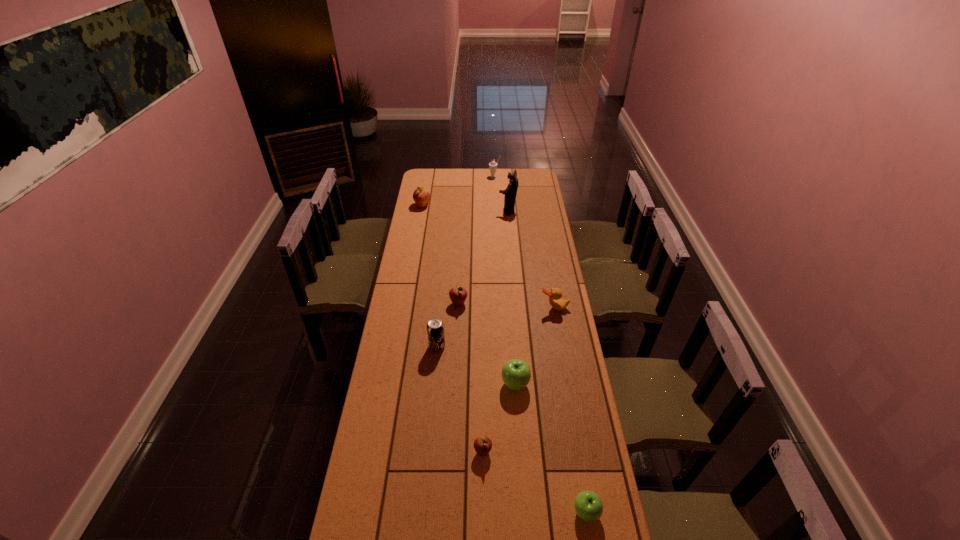
The height and width of the screenshot is (540, 960). Identify the location of the farther green apple. 516,374.

Identify the location of tan duck. (555, 294).

This screenshot has width=960, height=540. Identify the location of the second nearest object. (482, 445).

Locate an element on the screen. the nearest red apple is located at coordinates (482, 445).

This screenshot has height=540, width=960. What are the coordinates of `the rightmost apple` in the screenshot? It's located at (588, 505).

This screenshot has height=540, width=960. In order to click on the nearest object in this screenshot , I will do `click(588, 505)`.

I want to click on free spot located 0.340m on the front-facing side of the figurine, so coord(441,212).

The image size is (960, 540). I want to click on blank space located 0.310m on the front-facing side of the figurine, so click(445, 212).

Locate an element on the screen. blank space located 0.230m on the front-facing side of the figurine is located at coordinates (459, 212).

At what (x,y) coordinates should I click in order to perform the action: click on vacant space located 0.250m on the straw side of the milkshake. Please return your answer as a coordinate pair (x, y). The width and height of the screenshot is (960, 540). Looking at the image, I should click on (495, 201).